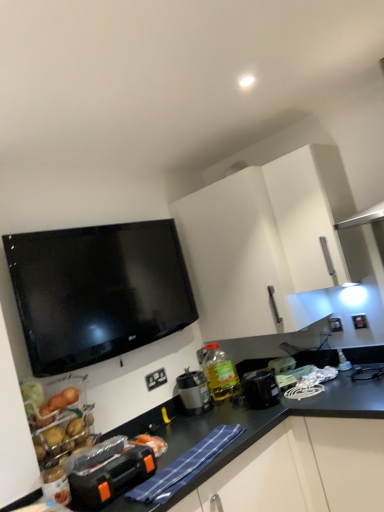
Question: Is matte black coffee maker at center, acting as the 3th appliance starting from the right, turned away from black plastic toolbox at lower left, the 1th appliance from the left?

Choices:
 (A) yes
 (B) no

Answer: (B)

Question: Is the position of matte black coffee maker at center, which ranks as the third appliance in front-to-back order, less distant than that of black plastic toolbox at lower left, the 1th appliance from the left?

Choices:
 (A) yes
 (B) no

Answer: (B)

Question: From the image's perspective, is matte black coffee maker at center, acting as the 3th appliance starting from the right, located above black plastic toolbox at lower left, placed as the 1th appliance when sorted from front to back?

Choices:
 (A) no
 (B) yes

Answer: (B)

Question: Is matte black coffee maker at center, acting as the 3th appliance starting from the right, oriented towards black plastic toolbox at lower left, placed as the 1th appliance when sorted from front to back?

Choices:
 (A) no
 (B) yes

Answer: (A)

Question: Is the surface of matte black coffee maker at center, acting as the 3th appliance starting from the right, in direct contact with black plastic toolbox at lower left, placed as the 1th appliance when sorted from front to back?

Choices:
 (A) no
 (B) yes

Answer: (A)

Question: Is matte black coffee maker at center, which is counted as the second appliance, starting from the back, smaller than black plastic toolbox at lower left, the 4th appliance from the right?

Choices:
 (A) no
 (B) yes

Answer: (B)

Question: Can white plastic electrical outlet at lower center, the first electric outlet in the left-to-right sequence, be found inside white plastic electric outlet at upper right, the first electric outlet viewed from the back?

Choices:
 (A) no
 (B) yes

Answer: (A)

Question: Does white plastic electric outlet at upper right, the first electric outlet positioned from the top, have a greater width compared to white plastic electrical outlet at lower center, which is the first electric outlet from bottom to top?

Choices:
 (A) yes
 (B) no

Answer: (A)

Question: Is white plastic electric outlet at upper right, the 1th electric outlet when ordered from right to left, at the right side of white plastic electrical outlet at lower center, which is the second electric outlet in top-to-bottom order?

Choices:
 (A) yes
 (B) no

Answer: (A)

Question: Is white plastic electric outlet at upper right, which appears as the 2th electric outlet when viewed from the front, facing towards white plastic electrical outlet at lower center, the 2th electric outlet viewed from the right?

Choices:
 (A) no
 (B) yes

Answer: (A)

Question: From a real-world perspective, is white plastic electric outlet at upper right, the first electric outlet positioned from the top, located higher than white plastic electrical outlet at lower center, the 2th electric outlet viewed from the right?

Choices:
 (A) yes
 (B) no

Answer: (A)

Question: From the image's perspective, would you say white plastic electric outlet at upper right, marked as the 2th electric outlet in a left-to-right arrangement, is shown under white plastic electrical outlet at lower center, the 2th electric outlet viewed from the right?

Choices:
 (A) yes
 (B) no

Answer: (B)

Question: Is white plastic electrical outlet at lower center, which is counted as the second electric outlet, starting from the back, shorter than matte black coffee maker at center, the 2th appliance positioned from the left?

Choices:
 (A) no
 (B) yes

Answer: (B)